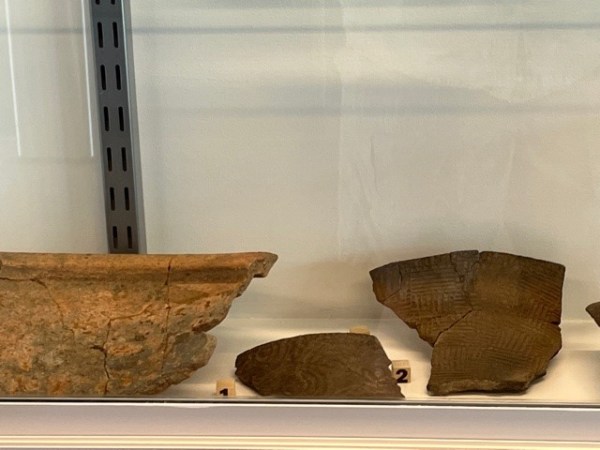
Find the location of a particular element. This screenshot has height=450, width=600. wall is located at coordinates (360, 173).